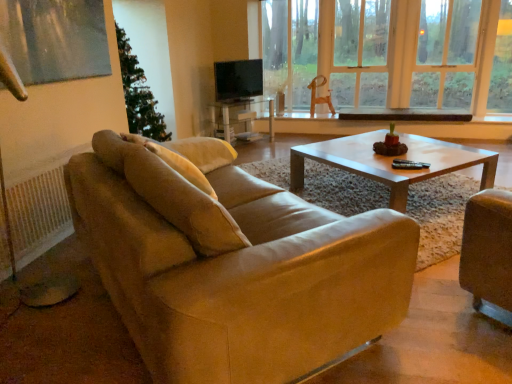
Image resolution: width=512 pixels, height=384 pixels. What do you see at coordinates (238, 79) in the screenshot?
I see `matte black tv at center` at bounding box center [238, 79].

The height and width of the screenshot is (384, 512). Identify the location of matte black tv at center. (238, 79).

The width and height of the screenshot is (512, 384). What do you see at coordinates (319, 97) in the screenshot?
I see `wooden swivel chair at center` at bounding box center [319, 97].

What are the coordinates of `black plastic corded phone at center` in the screenshot? It's located at (409, 164).

Is suede beige couch at center situated inside beige fabric pillow at upper left or outside?

suede beige couch at center is located beyond the bounds of beige fabric pillow at upper left.

Does suede beige couch at center have a lesser width compared to beige fabric pillow at upper left?

No, suede beige couch at center is not thinner than beige fabric pillow at upper left.

From a real-world perspective, which is physically above, suede beige couch at center or beige fabric pillow at upper left?

beige fabric pillow at upper left.

Is suede beige couch at center oriented towards beige fabric pillow at upper left?

No, suede beige couch at center is not aimed at beige fabric pillow at upper left.

Locate an element on the screen. pillow that appears in front of the matte black tv at center is located at coordinates (174, 162).

From a real-world perspective, does matte black tv at center stand above beige fabric pillow at upper left?

Indeed, from a real-world perspective, matte black tv at center stands above beige fabric pillow at upper left.

Based on the photo, is matte black tv at center in front of beige fabric pillow at upper left?

No, it is not.

What are the coordinates of `pillow that appears on the left of black plastic corded phone at center` in the screenshot? It's located at pos(174,162).

Is black plastic corded phone at center facing towards beige fabric pillow at upper left?

No, black plastic corded phone at center is not oriented towards beige fabric pillow at upper left.

Is black plastic corded phone at center wider than beige fabric pillow at upper left?

In fact, black plastic corded phone at center might be narrower than beige fabric pillow at upper left.

Is black plastic corded phone at center at the right side of beige fabric pillow at upper left?

Yes, black plastic corded phone at center is to the right of beige fabric pillow at upper left.

Considering the positions of point (316, 216) and point (406, 4), is point (316, 216) closer or farther from the camera than point (406, 4)?

Clearly, point (316, 216) is closer to the camera than point (406, 4).

Is transparent glass window at center a part of suede beige couch at center?

Actually, transparent glass window at center is outside suede beige couch at center.

Between suede beige couch at center and transparent glass window at center, which one has smaller size?

transparent glass window at center.

Which object is closer to the camera taking this photo, suede beige couch at center or transparent glass window at center?

suede beige couch at center is closer to the camera.

In the scene shown: Which is nearer, (x=218, y=175) or (x=252, y=81)?

The point (x=218, y=175) is more forward.

Considering the relative positions of suede beige couch at center and matte black tv at center in the image provided, is suede beige couch at center to the left of matte black tv at center from the viewer's perspective?

Yes, suede beige couch at center is to the left of matte black tv at center.

Based on the photo, is suede beige couch at center not within matte black tv at center?

Indeed, suede beige couch at center is completely outside matte black tv at center.

Is suede beige couch at center far away from matte black tv at center?

Yes.

Is beige fabric pillow at upper left not within matte black tv at center?

Absolutely, beige fabric pillow at upper left is external to matte black tv at center.

Looking at this image, considering the relative sizes of beige fabric pillow at upper left and matte black tv at center in the image provided, is beige fabric pillow at upper left thinner than matte black tv at center?

No.

Is beige fabric pillow at upper left in front of or behind matte black tv at center in the image?

Clearly, beige fabric pillow at upper left is in front of matte black tv at center.

Looking at the image, does matte glass coffee table at center seem bigger or smaller compared to wooden swivel chair at center?

In the image, matte glass coffee table at center appears to be larger than wooden swivel chair at center.

This screenshot has height=384, width=512. Identify the location of cocktail table beneath the wooden swivel chair at center (from a real-world perspective). (239, 118).

Is point (239, 115) in front of point (333, 107)?

That is True.

The width and height of the screenshot is (512, 384). Identify the location of pillow behind the suede beige couch at center. click(174, 162).

At what (x,y) coordinates should I click in order to perform the action: click on pillow in front of the matte black tv at center. Please return your answer as a coordinate pair (x, y). The height and width of the screenshot is (384, 512). Looking at the image, I should click on (174, 162).

Based on their spatial positions, is wooden swivel chair at center or suede beige couch at center further from beige fabric pillow at upper left?

wooden swivel chair at center is further to beige fabric pillow at upper left.

Based on their spatial positions, is wooden swivel chair at center or transparent glass window at center closer to suede beige couch at center?

wooden swivel chair at center.

From the image, which object appears to be nearer to beige fabric pillow at upper left, suede beige couch at center or wooden swivel chair at center?

The object closer to beige fabric pillow at upper left is suede beige couch at center.

When comparing their distances from suede beige couch at center, does matte glass coffee table at center or black plastic corded phone at center seem closer?

black plastic corded phone at center is closer to suede beige couch at center.

From the image, which object appears to be farther from suede beige couch at center, beige fabric pillow at upper left or matte glass coffee table at center?

matte glass coffee table at center is positioned further to the anchor suede beige couch at center.

Considering their positions, is transparent glass window at center positioned further to wooden swivel chair at center than suede beige couch at center?

Among the two, suede beige couch at center is located further to wooden swivel chair at center.

When comparing their distances from matte glass coffee table at center, does transparent glass window at center or matte black tv at center seem further?

Based on the image, transparent glass window at center appears to be further to matte glass coffee table at center.

When comparing their distances from matte glass coffee table at center, does suede beige couch at center or transparent glass window at center seem further?

suede beige couch at center is further to matte glass coffee table at center.

The height and width of the screenshot is (384, 512). What are the coordinates of `corded phone between suede beige couch at center and wooden swivel chair at center in the front-back direction` in the screenshot? It's located at (409, 164).

This screenshot has height=384, width=512. What are the coordinates of `corded phone between beige fabric pillow at upper left and wooden swivel chair at center from front to back` in the screenshot? It's located at (409, 164).

The width and height of the screenshot is (512, 384). What are the coordinates of `swivel chair located between matte black tv at center and transparent glass window at center in the left-right direction` in the screenshot? It's located at pyautogui.click(x=319, y=97).

Locate an element on the screen. television between suede beige couch at center and transparent glass window at center from front to back is located at coordinates (238, 79).